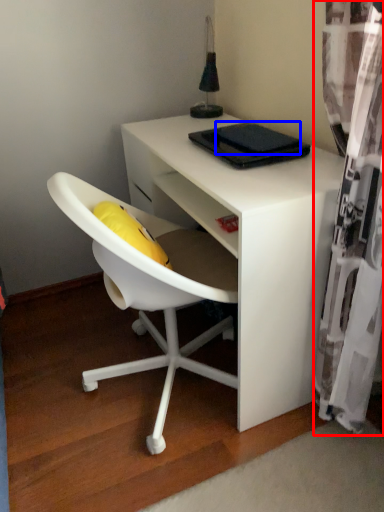
Question: Which point is further to the camera, curtain (highlighted by a red box) or pad (highlighted by a blue box)?

Choices:
 (A) curtain
 (B) pad

Answer: (B)